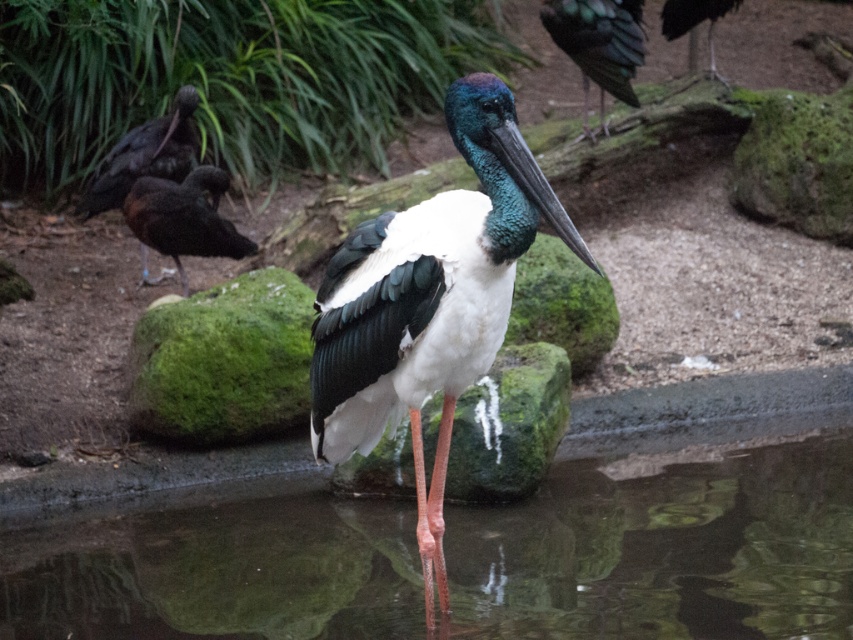
Question: Among these points, which one is farthest from the camera?

Choices:
 (A) (712, 12)
 (B) (149, 230)
 (C) (181, 104)
 (D) (479, 376)

Answer: (A)

Question: Is white glossy stork at center above shiny green feathers at upper right?

Choices:
 (A) no
 (B) yes

Answer: (A)

Question: Does shiny black bird at left come in front of shiny black bird at upper left?

Choices:
 (A) no
 (B) yes

Answer: (B)

Question: Considering the real-world distances, which object is closest to the shiny black bird at upper left?

Choices:
 (A) shiny black bird at left
 (B) white glossy stork at center
 (C) shiny black bird at upper right

Answer: (A)

Question: Which point is farther to the camera?

Choices:
 (A) shiny black bird at upper right
 (B) shiny black bird at upper left

Answer: (A)

Question: Does clear water at center come behind shiny green feathers at upper right?

Choices:
 (A) no
 (B) yes

Answer: (A)